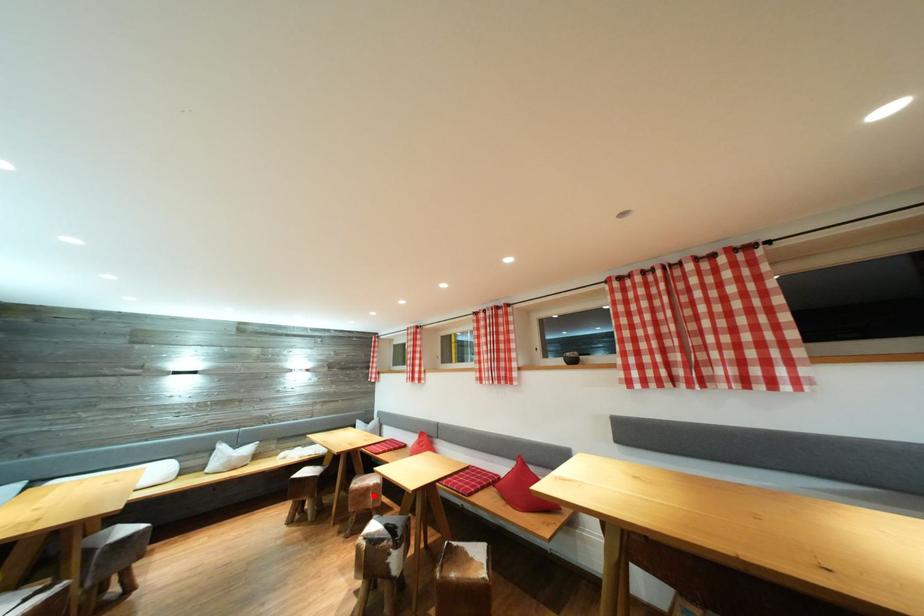
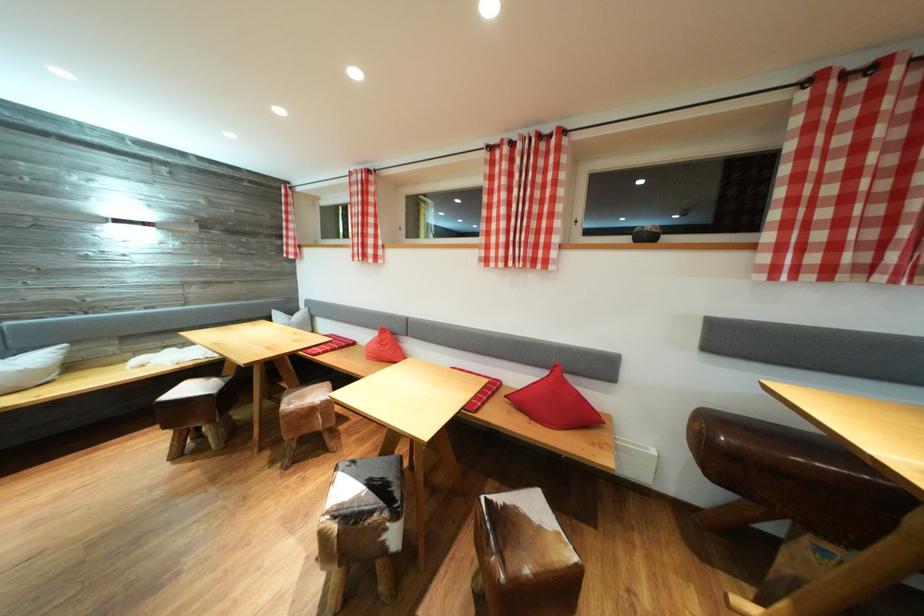
Locate, in the second image, the point that corresponds to the highlighted location in the first image.

(319, 416)